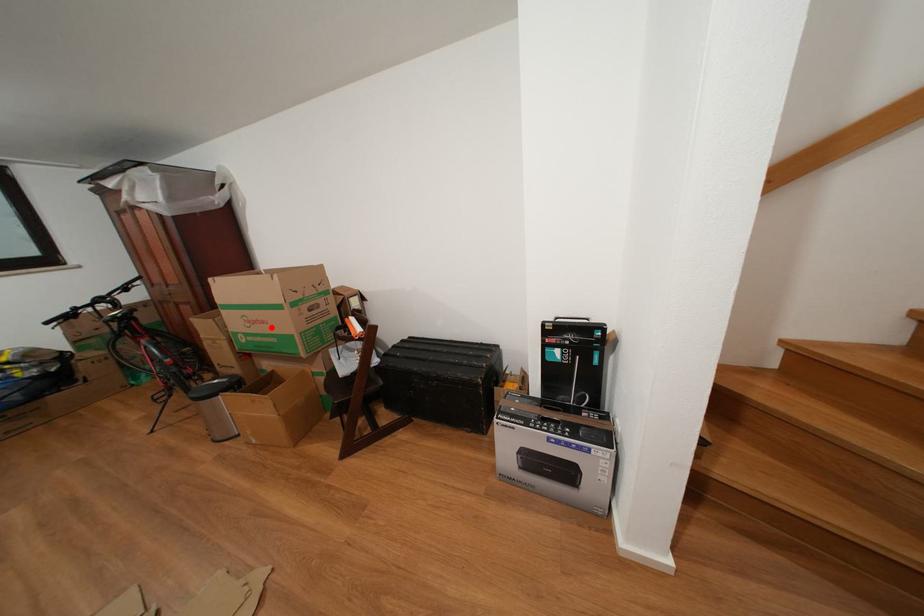
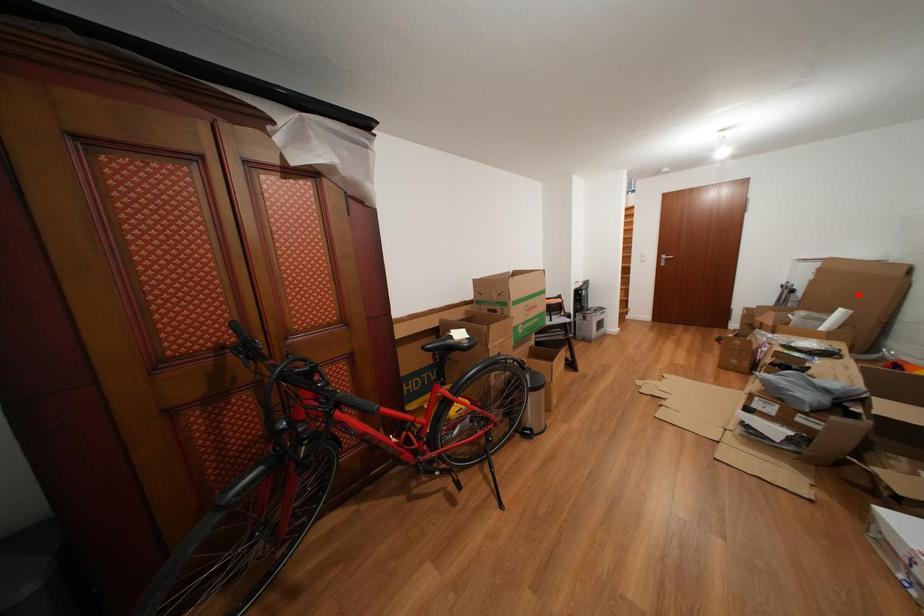
I am providing you with two images of the same scene from different viewpoints. A red point is marked on the first image and another point is marked on the second image. Is the red point in image1 aligned with the point shown in image2?

No